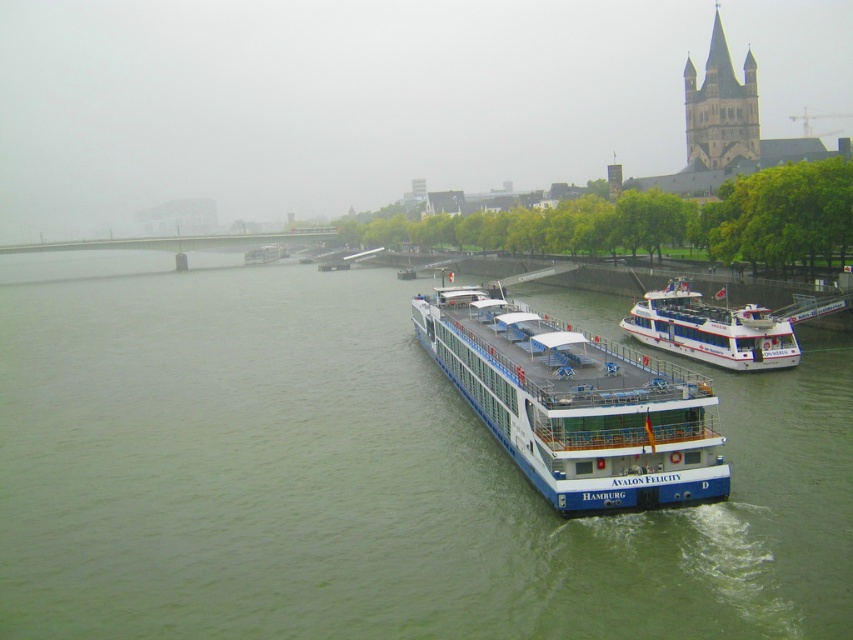
Can you confirm if green water at center is thinner than white glossy cruise ship at center?

No, green water at center is not thinner than white glossy cruise ship at center.

Is point (434, 538) in front of point (489, 362)?

Yes, it is.

Where is `green water at center`? This screenshot has width=853, height=640. green water at center is located at coordinates (363, 476).

Does white glossy cruise ship at center have a lesser width compared to white glossy boat at center?

No, white glossy cruise ship at center is not thinner than white glossy boat at center.

Is white glossy cruise ship at center positioned at the back of white glossy boat at center?

No.

Is point (469, 400) farther from viewer compared to point (708, 324)?

No, it is in front of (708, 324).

The width and height of the screenshot is (853, 640). I want to click on white glossy cruise ship at center, so click(x=576, y=404).

Between green water at center and white glossy boat at center, which one is positioned lower?

white glossy boat at center

Can you confirm if green water at center is bigger than white glossy boat at center?

Yes.

The image size is (853, 640). Find the location of `green water at center`. green water at center is located at coordinates (363, 476).